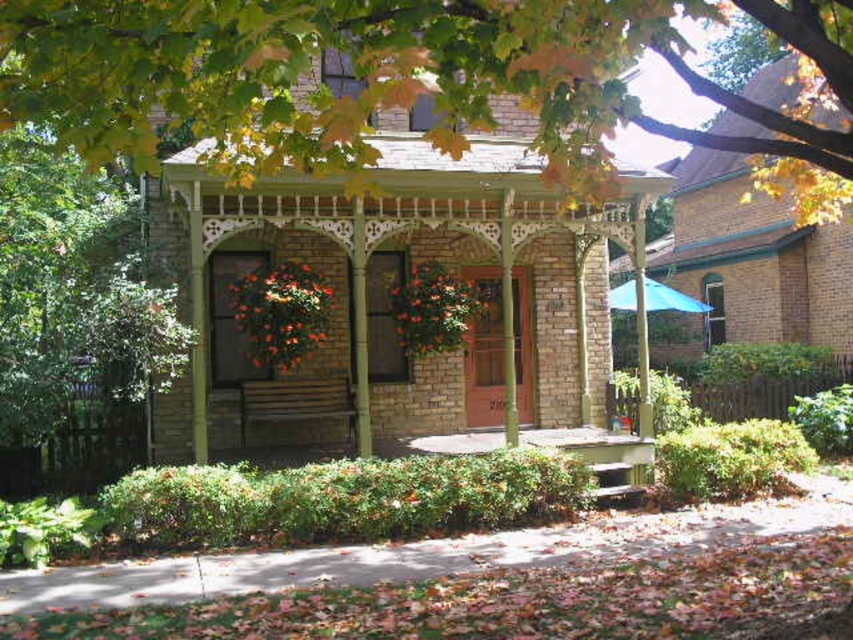
You are planning to install a new garden feature between the green leafy tree at upper center and the green wood gazebo at center. Considering their sizes, which one would allow more space for your feature?

The green wood gazebo at center occupies more space than the green leafy tree at upper center, so installing the garden feature near the green wood gazebo at center would allow more space for the feature.

You are standing on the front porch of the house and want to take a photo of the green leafy tree at upper center. Where should you position yourself to capture the tree in the center of your camera viewfinder?

To center the green leafy tree at upper center in your camera viewfinder, position yourself directly in front of the tree at coordinates approximately 0.131 on the x and 0.443 on the y axis.

You are standing on the front porch of the house and want to place a small potted plant between the two points labeled point (120, 52) and point (648, 202). Which point should the plant be closer to in order to be nearer to the entrance door?

The entrance door is located near the lower part of the porch, so placing the plant closer to point (120, 52) would position it nearer to the entrance door.